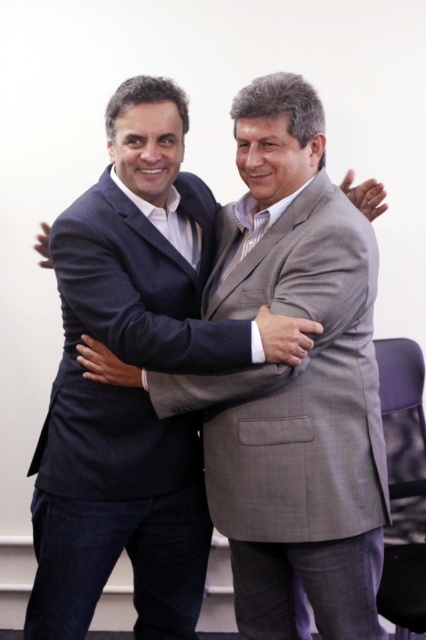
Which of these two, matte black suit at center or matte black suit at left, stands shorter?

With less height is matte black suit at left.

Is point (278, 508) closer to camera compared to point (63, 372)?

Yes, point (278, 508) is closer to viewer.

Locate an element on the screen. This screenshot has width=426, height=640. matte black suit at center is located at coordinates (288, 381).